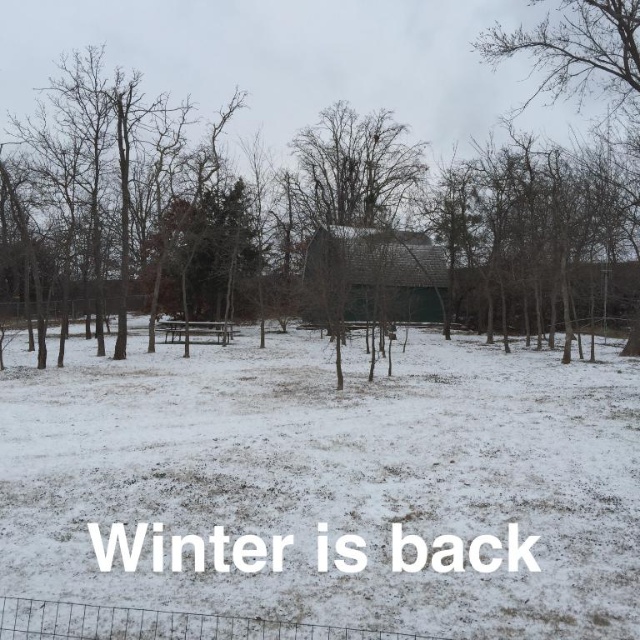
Is dark gray shingles barn at center above bare branches at upper right?

No, dark gray shingles barn at center is not above bare branches at upper right.

Is point (380, 301) positioned behind point (513, 35)?

That is False.

Identify the location of dark gray shingles barn at center. (372, 276).